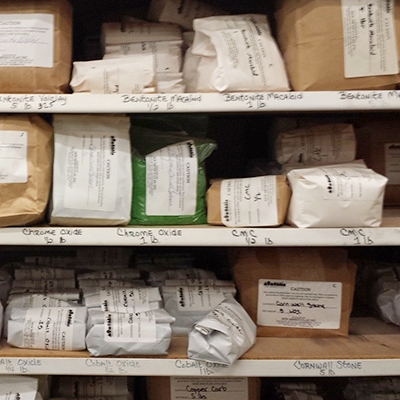
Locate an element on the screen. The image size is (400, 400). shelf is located at coordinates (290, 353).